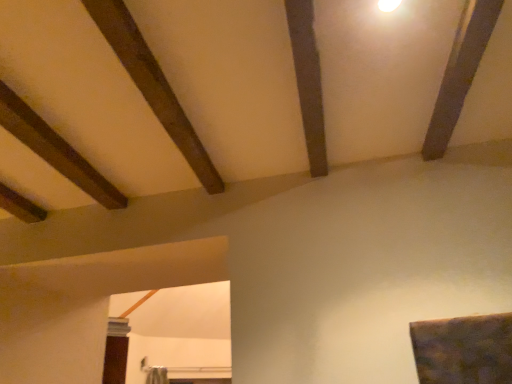
How much space does dark brown wood plank at upper center, which is counted as the first plank, starting from the right, occupy vertically?

dark brown wood plank at upper center, which is counted as the first plank, starting from the right, is 3.53 inches in height.

How much space does dark brown wood plank at upper center, which is counted as the first plank, starting from the right, occupy horizontally?

5.93 inches.

The height and width of the screenshot is (384, 512). In order to click on dark brown wood plank at upper center, which is counted as the first plank, starting from the right in this screenshot , I will do `click(308, 81)`.

This screenshot has width=512, height=384. What do you see at coordinates (308, 81) in the screenshot?
I see `dark brown wood plank at upper center, which is counted as the first plank, starting from the right` at bounding box center [308, 81].

Locate an element on the screen. dark brown wood at upper left, which is the first plank in left-to-right order is located at coordinates (153, 85).

In order to face dark brown wood at upper left, the second plank viewed from the right, should I rotate leftwards or rightwards?

You should look left and rotate roughly 10.833 degrees.

Describe the element at coordinates (153, 85) in the screenshot. I see `dark brown wood at upper left, the second plank viewed from the right` at that location.

At what (x,y) coordinates should I click in order to perform the action: click on dark brown wood plank at upper center, positioned as the 2th plank in left-to-right order. Please return your answer as a coordinate pair (x, y). The image size is (512, 384). Looking at the image, I should click on (308, 81).

Which is more to the left, dark brown wood at upper left, which is the first plank in left-to-right order, or dark brown wood plank at upper center, positioned as the 2th plank in left-to-right order?

dark brown wood at upper left, which is the first plank in left-to-right order.

Relative to dark brown wood plank at upper center, positioned as the 2th plank in left-to-right order, is dark brown wood at upper left, the second plank viewed from the right, in front or behind?

dark brown wood at upper left, the second plank viewed from the right, is positioned closer to the viewer than dark brown wood plank at upper center, positioned as the 2th plank in left-to-right order.

Which is farther from the camera, (127, 19) or (308, 78)?

The point (308, 78) is behind.

From the image's perspective, is dark brown wood at upper left, which is the first plank in left-to-right order, located above dark brown wood plank at upper center, positioned as the 2th plank in left-to-right order?

Incorrect, from the image's perspective, dark brown wood at upper left, which is the first plank in left-to-right order, is lower than dark brown wood plank at upper center, positioned as the 2th plank in left-to-right order.

From a real-world perspective, does dark brown wood at upper left, which is the first plank in left-to-right order, sit lower than dark brown wood plank at upper center, positioned as the 2th plank in left-to-right order?

Incorrect, from a real-world perspective, dark brown wood at upper left, which is the first plank in left-to-right order, is higher than dark brown wood plank at upper center, positioned as the 2th plank in left-to-right order.

From the picture: Which of these two, dark brown wood at upper left, which is the first plank in left-to-right order, or dark brown wood plank at upper center, which is counted as the first plank, starting from the right, is wider?

dark brown wood at upper left, which is the first plank in left-to-right order, is wider.

Is dark brown wood at upper left, the second plank viewed from the right, taller than dark brown wood plank at upper center, which is counted as the first plank, starting from the right?

Correct, dark brown wood at upper left, the second plank viewed from the right, is much taller as dark brown wood plank at upper center, which is counted as the first plank, starting from the right.

Considering the sizes of objects dark brown wood at upper left, which is the first plank in left-to-right order, and dark brown wood plank at upper center, which is counted as the first plank, starting from the right, in the image provided, who is bigger, dark brown wood at upper left, which is the first plank in left-to-right order, or dark brown wood plank at upper center, which is counted as the first plank, starting from the right,?

dark brown wood at upper left, which is the first plank in left-to-right order.

Is dark brown wood at upper left, the second plank viewed from the right, not inside dark brown wood plank at upper center, which is counted as the first plank, starting from the right?

Yes, dark brown wood at upper left, the second plank viewed from the right, is outside of dark brown wood plank at upper center, which is counted as the first plank, starting from the right.

Would you consider dark brown wood at upper left, the second plank viewed from the right, to be distant from dark brown wood plank at upper center, positioned as the 2th plank in left-to-right order?

That's not correct — dark brown wood at upper left, the second plank viewed from the right, is a little close to dark brown wood plank at upper center, positioned as the 2th plank in left-to-right order.

Is dark brown wood at upper left, which is the first plank in left-to-right order, oriented away from dark brown wood plank at upper center, positioned as the 2th plank in left-to-right order?

Yes, dark brown wood at upper left, which is the first plank in left-to-right order, is positioned with its back facing dark brown wood plank at upper center, positioned as the 2th plank in left-to-right order.

Image resolution: width=512 pixels, height=384 pixels. I want to click on plank that is under the dark brown wood at upper left, the second plank viewed from the right (from a real-world perspective), so click(x=308, y=81).

In the image, is dark brown wood plank at upper center, positioned as the 2th plank in left-to-right order, on the left side or the right side of dark brown wood at upper left, which is the first plank in left-to-right order?

Based on their positions, dark brown wood plank at upper center, positioned as the 2th plank in left-to-right order, is located to the right of dark brown wood at upper left, which is the first plank in left-to-right order.

Between dark brown wood plank at upper center, positioned as the 2th plank in left-to-right order, and dark brown wood at upper left, the second plank viewed from the right, which one is positioned behind?

Positioned behind is dark brown wood plank at upper center, positioned as the 2th plank in left-to-right order.

Is point (306, 32) farther from viewer compared to point (151, 87)?

No, (306, 32) is closer to viewer.

From the image's perspective, between dark brown wood plank at upper center, positioned as the 2th plank in left-to-right order, and dark brown wood at upper left, which is the first plank in left-to-right order, who is located below?

dark brown wood at upper left, which is the first plank in left-to-right order, from the image's perspective.

From a real-world perspective, between dark brown wood plank at upper center, positioned as the 2th plank in left-to-right order, and dark brown wood at upper left, the second plank viewed from the right, who is vertically higher?

dark brown wood at upper left, the second plank viewed from the right, is physically above.

Consider the image. Which object is thinner, dark brown wood plank at upper center, positioned as the 2th plank in left-to-right order, or dark brown wood at upper left, the second plank viewed from the right?

dark brown wood plank at upper center, positioned as the 2th plank in left-to-right order, is thinner.

Between dark brown wood plank at upper center, positioned as the 2th plank in left-to-right order, and dark brown wood at upper left, which is the first plank in left-to-right order, which one has less height?

Standing shorter between the two is dark brown wood plank at upper center, positioned as the 2th plank in left-to-right order.

Considering the sizes of dark brown wood plank at upper center, which is counted as the first plank, starting from the right, and dark brown wood at upper left, which is the first plank in left-to-right order, in the image, is dark brown wood plank at upper center, which is counted as the first plank, starting from the right, bigger or smaller than dark brown wood at upper left, which is the first plank in left-to-right order,?

dark brown wood plank at upper center, which is counted as the first plank, starting from the right, is smaller than dark brown wood at upper left, which is the first plank in left-to-right order.

Is dark brown wood plank at upper center, positioned as the 2th plank in left-to-right order, spatially inside dark brown wood at upper left, the second plank viewed from the right, or outside of it?

dark brown wood plank at upper center, positioned as the 2th plank in left-to-right order, is spatially situated outside dark brown wood at upper left, the second plank viewed from the right.

Is dark brown wood plank at upper center, which is counted as the first plank, starting from the right, touching dark brown wood at upper left, which is the first plank in left-to-right order?

dark brown wood plank at upper center, which is counted as the first plank, starting from the right, and dark brown wood at upper left, which is the first plank in left-to-right order, are not in contact.

Is dark brown wood plank at upper center, which is counted as the first plank, starting from the right, aimed at dark brown wood at upper left, the second plank viewed from the right?

Yes, dark brown wood plank at upper center, which is counted as the first plank, starting from the right, is aimed at dark brown wood at upper left, the second plank viewed from the right.

Identify the location of plank below the dark brown wood at upper left, which is the first plank in left-to-right order (from a real-world perspective). click(308, 81).

In the image, there is a dark brown wood at upper left, which is the first plank in left-to-right order. Identify the location of plank above it (from the image's perspective). (308, 81).

This screenshot has height=384, width=512. I want to click on plank located on the left of dark brown wood plank at upper center, which is counted as the first plank, starting from the right, so click(153, 85).